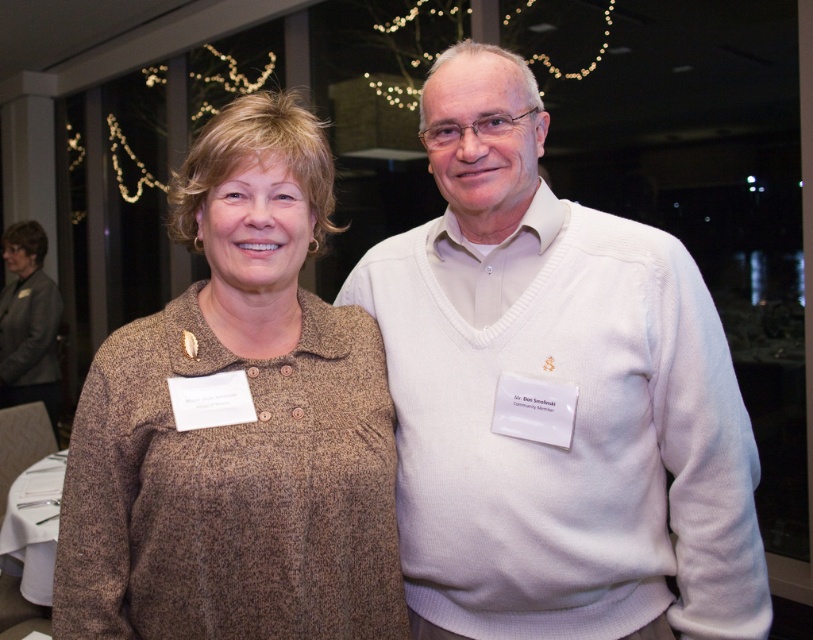
Question: Observing the image, what is the correct spatial positioning of white knit sweater at center in reference to brown woolen sweater at center?

Choices:
 (A) below
 (B) above

Answer: (A)

Question: Is white knit sweater at center positioned at the back of brown woolen sweater at center?

Choices:
 (A) no
 (B) yes

Answer: (B)

Question: Is white knit sweater at center closer to camera compared to brown woolen sweater at center?

Choices:
 (A) no
 (B) yes

Answer: (A)

Question: Which of the following is the closest to the observer?

Choices:
 (A) brown woolen sweater at center
 (B) white knit sweater at center

Answer: (A)

Question: Which point appears farthest from the camera in this image?

Choices:
 (A) (489, 346)
 (B) (177, 588)

Answer: (A)